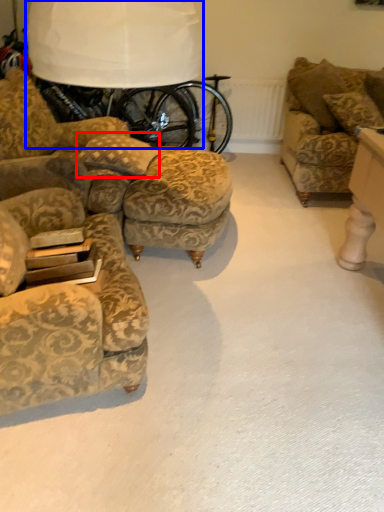
Question: Among these objects, which one is farthest to the camera, pillow (highlighted by a red box) or table lamp (highlighted by a blue box)?

Choices:
 (A) pillow
 (B) table lamp

Answer: (B)